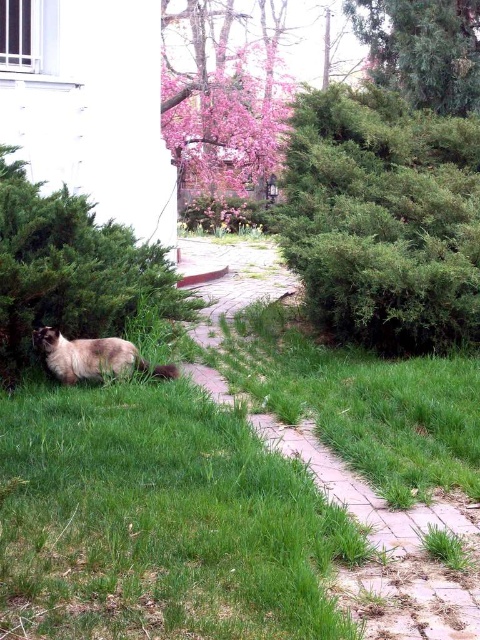
You are a gardener who wants to plant a new flower bed between the green grass at center and the pink blossom tree at upper center. Considering their heights, which area would be more suitable for taller plants?

The green grass at center has a greater height compared to the pink blossom tree at upper center, so the area near the green grass at center would be more suitable for taller plants since it already accommodates taller vegetation.

You are a gardener planning to plant a new flower bed between the green leafy bush at lower left and the pink blossom tree at upper center. Based on their sizes, which object should you place the flowers closer to for better visibility?

The green leafy bush at lower left might be wider than the pink blossom tree at upper center, so placing the flowers closer to the pink blossom tree at upper center would ensure better visibility as it might have a narrower width.